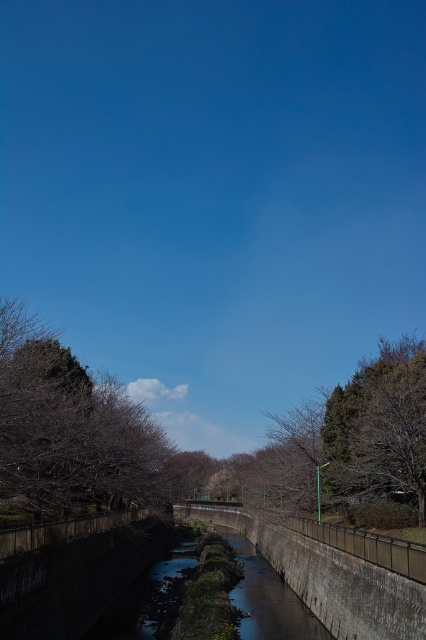
You are standing at the point marked by the coordinates point (362, 429). Looking around, you see a green metallic pole at center right. What object is located at your current position?

The point (362, 429) corresponds to the green metallic pole at center right.